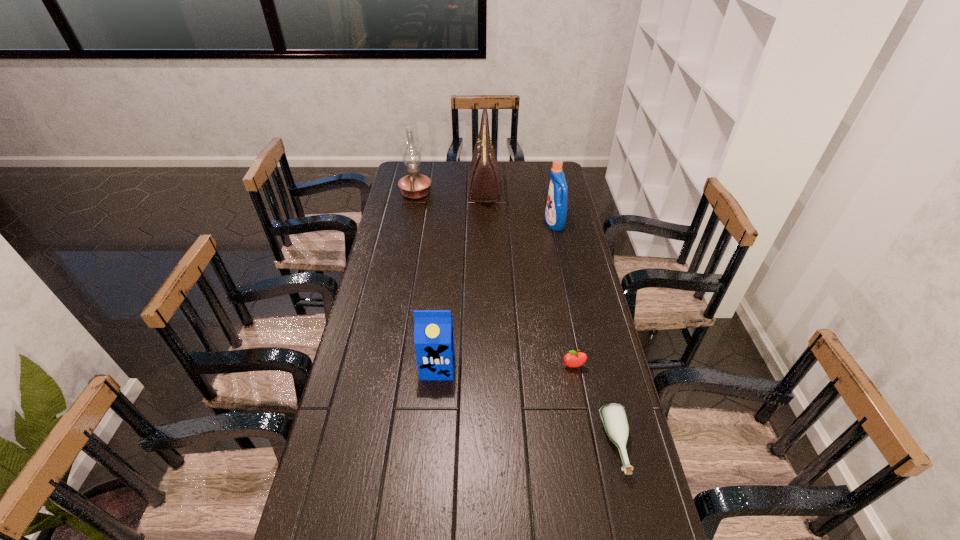
At what (x,y) coordinates should I click in order to perform the action: click on handbag. Please return your answer as a coordinate pair (x, y). This screenshot has width=960, height=540. Looking at the image, I should click on (484, 184).

At what (x,y) coordinates should I click in order to perform the action: click on the fourth object from right to left. Please return your answer as a coordinate pair (x, y). The image size is (960, 540). Looking at the image, I should click on (484, 184).

Find the location of `oil lamp`. oil lamp is located at coordinates (413, 186).

Image resolution: width=960 pixels, height=540 pixels. In order to click on detergent in this screenshot , I will do point(555,215).

You are a GUI agent. You are given a task and a screenshot of the screen. Output one action in this format:
    pyautogui.click(x=<x>, y=<y>)
    Task: Click on the carton
    The image size is (960, 540).
    Given the screenshot: What is the action you would take?
    pyautogui.click(x=433, y=329)

At what (x,y) coordinates should I click in order to perform the action: click on apple. Please return your answer as a coordinate pair (x, y). Looking at the image, I should click on (573, 359).

Where is `the shortest object`? the shortest object is located at coordinates (613, 415).

I want to click on bottle, so click(x=613, y=415).

Locate an element on the screen. The image size is (960, 540). free location located 0.210m on the front-facing side of the fourth object from right to left is located at coordinates (424, 188).

In order to click on free location located on the front-facing side of the fourth object from right to left in this screenshot , I will do `click(422, 188)`.